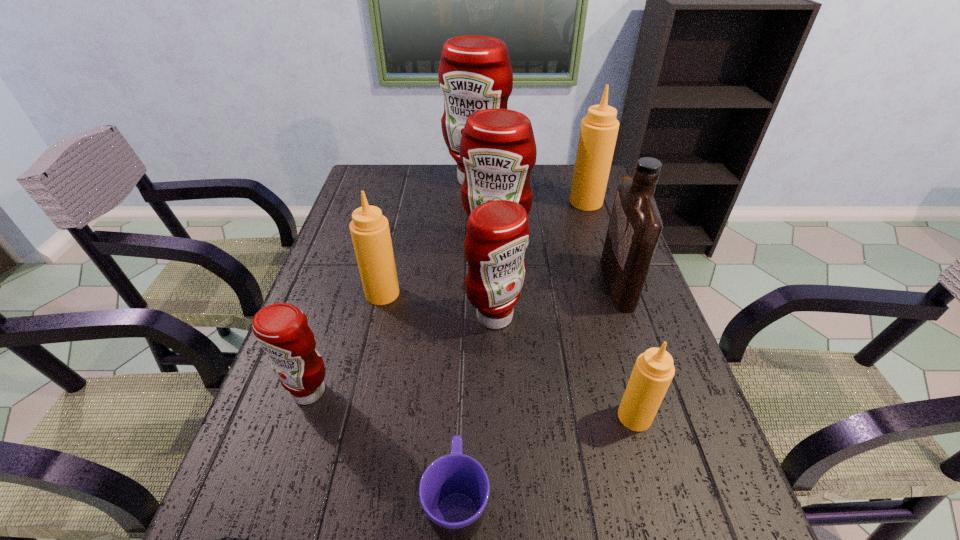
At what (x,y) coordinates should I click in order to perform the action: click on the nearest red condiment. Please return your answer as a coordinate pair (x, y). The width and height of the screenshot is (960, 540). Looking at the image, I should click on (282, 330).

Where is `the leftmost condiment`? The image size is (960, 540). the leftmost condiment is located at coordinates (282, 330).

In order to click on free spot located 0.060m on the front of the biggest red condiment in this screenshot , I will do `click(475, 203)`.

The image size is (960, 540). Identify the location of free region located on the right of the third nearest red condiment. (628, 243).

The height and width of the screenshot is (540, 960). Identify the location of vacant region located on the left of the farthest tan condiment. (481, 202).

Locate an element on the screen. This screenshot has height=540, width=960. free location located 0.330m on the label side of the liquor is located at coordinates (479, 284).

Image resolution: width=960 pixels, height=540 pixels. Identify the location of vacant space situated on the label side of the liquor. (509, 284).

At what (x,y) coordinates should I click in order to perform the action: click on vacant region located on the label side of the liquor. Please return your answer as a coordinate pair (x, y). This screenshot has width=960, height=540. Looking at the image, I should click on click(540, 284).

You are a GUI agent. You are given a task and a screenshot of the screen. Output one action in this format:
    pyautogui.click(x=<x>, y=<y>)
    Task: Click on the vacant space located on the right of the second smallest tan condiment
    This screenshot has height=540, width=960.
    Given the screenshot: What is the action you would take?
    pyautogui.click(x=486, y=293)

You are a GUI agent. You are given a task and a screenshot of the screen. Output one action in this format:
    pyautogui.click(x=<x>, y=<y>)
    Task: Click on the vacant area situated 0.070m on the back of the second smallest red condiment
    The image size is (960, 540).
    Given the screenshot: What is the action you would take?
    pyautogui.click(x=493, y=280)